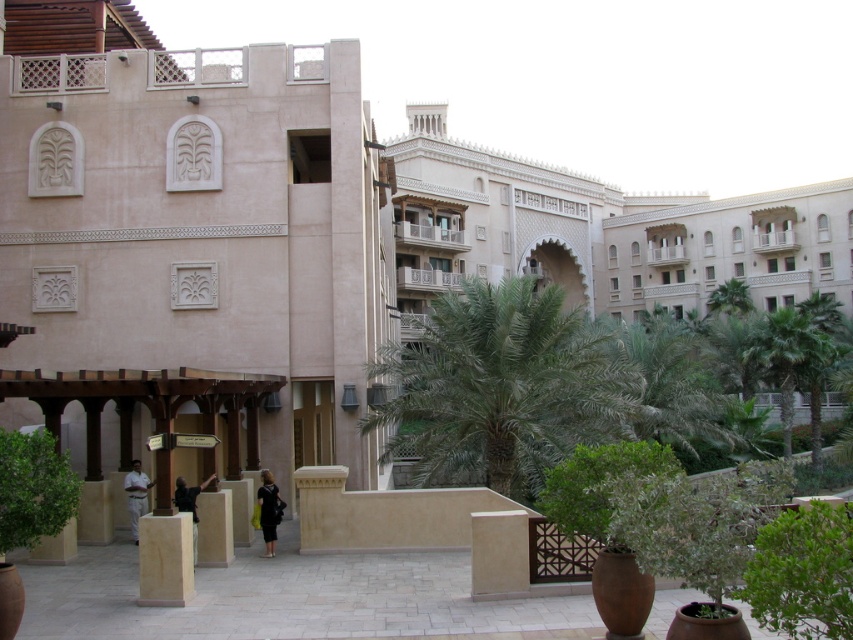
Question: Estimate the real-world distances between objects in this image. Which object is closer to the green leafy palm tree at center?

Choices:
 (A) matte beige building at center
 (B) green leafy bush at lower left

Answer: (A)

Question: Where is matte beige building at center located in relation to green leafy bush at lower left in the image?

Choices:
 (A) left
 (B) right

Answer: (A)

Question: Can you confirm if green leafy palm tree at center is smaller than green leafy bush at lower left?

Choices:
 (A) no
 (B) yes

Answer: (A)

Question: Which point is closer to the camera taking this photo?

Choices:
 (A) (213, 51)
 (B) (28, 545)

Answer: (B)

Question: Which point is farther to the camera?

Choices:
 (A) matte beige building at center
 (B) green leafy palm tree at center

Answer: (B)

Question: Does green leafy palm tree at center appear over green leafy bush at lower left?

Choices:
 (A) no
 (B) yes

Answer: (B)